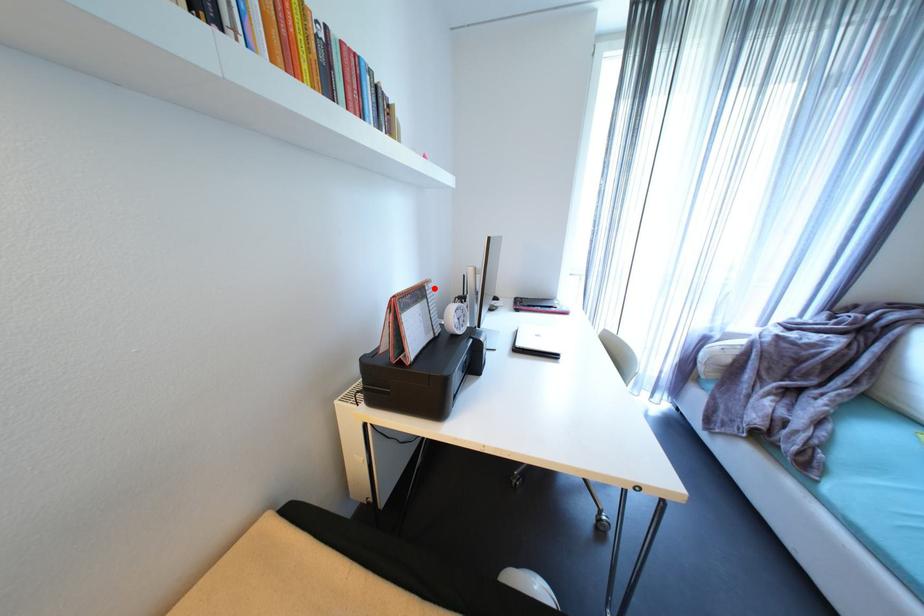
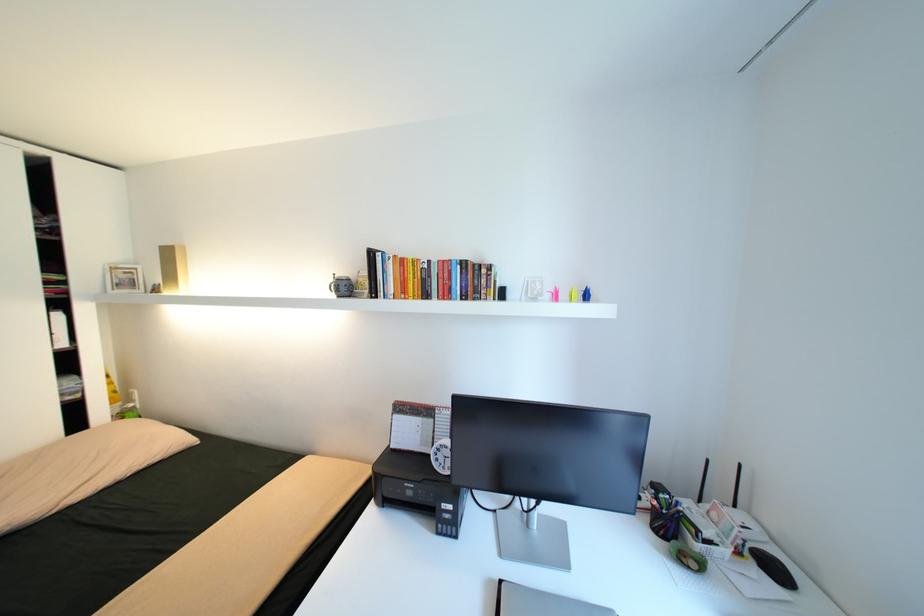
Locate, in the second image, the point that corresponds to the highlighted location in the first image.

(444, 411)